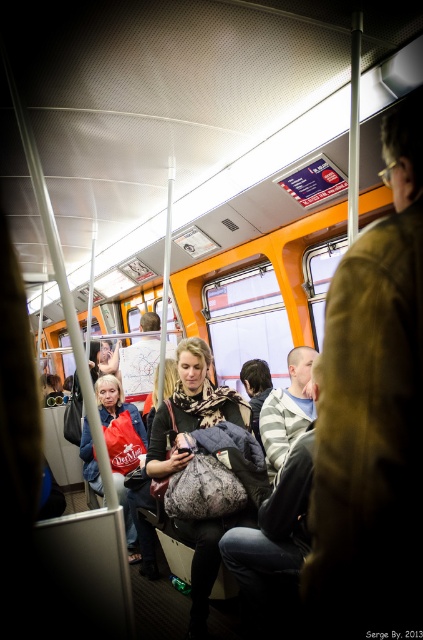
A passenger is sitting at the front of the train and wants to pick up the leopard print scarf at center. Which direction should they move to reach it?

The leopard print scarf at center is located at point (192,406), so the passenger should move towards the center of the train to reach it.

You are a passenger on the train and you want to retrieve your leopard print scarf at center from under the brown leather jacket at right. Is the jacket currently covering the scarf?

The brown leather jacket at right is located above the leopard print scarf at center, so yes, the jacket is covering the scarf.